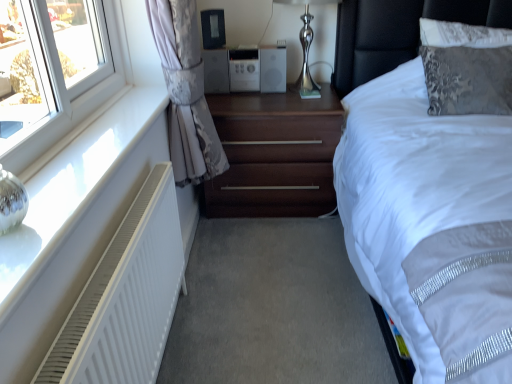
Question: Is silver metallic stereo at center wider than black plastic speaker at upper center?

Choices:
 (A) yes
 (B) no

Answer: (A)

Question: Can you confirm if silver metallic stereo at center is bigger than black plastic speaker at upper center?

Choices:
 (A) no
 (B) yes

Answer: (B)

Question: Can black plastic speaker at upper center be found inside silver metallic stereo at center?

Choices:
 (A) no
 (B) yes

Answer: (A)

Question: Is silver metallic stereo at center to the left of black plastic speaker at upper center from the viewer's perspective?

Choices:
 (A) yes
 (B) no

Answer: (B)

Question: From the image's perspective, is silver metallic stereo at center over black plastic speaker at upper center?

Choices:
 (A) yes
 (B) no

Answer: (B)

Question: Looking at the image, does silver metallic stereo at center seem bigger or smaller compared to white matte radiator at left?

Choices:
 (A) big
 (B) small

Answer: (B)

Question: From a real-world perspective, is silver metallic stereo at center physically located above or below white matte radiator at left?

Choices:
 (A) below
 (B) above

Answer: (B)

Question: Is silver metallic stereo at center in front of or behind white matte radiator at left in the image?

Choices:
 (A) behind
 (B) front

Answer: (A)

Question: From the image's perspective, is silver metallic stereo at center positioned above or below white matte radiator at left?

Choices:
 (A) above
 (B) below

Answer: (A)

Question: From the image's perspective, is black leather headboard at upper right above or below black plastic speaker at upper center?

Choices:
 (A) above
 (B) below

Answer: (B)

Question: From their relative heights in the image, would you say black leather headboard at upper right is taller or shorter than black plastic speaker at upper center?

Choices:
 (A) tall
 (B) short

Answer: (A)

Question: In terms of width, does black leather headboard at upper right look wider or thinner when compared to black plastic speaker at upper center?

Choices:
 (A) wide
 (B) thin

Answer: (A)

Question: Does point (386, 64) appear closer or farther from the camera than point (211, 43)?

Choices:
 (A) closer
 (B) farther

Answer: (B)

Question: Is point (208, 13) closer or farther from the camera than point (76, 309)?

Choices:
 (A) farther
 (B) closer

Answer: (A)

Question: Relative to white matte radiator at left, is black plastic speaker at upper center in front or behind?

Choices:
 (A) front
 (B) behind

Answer: (B)